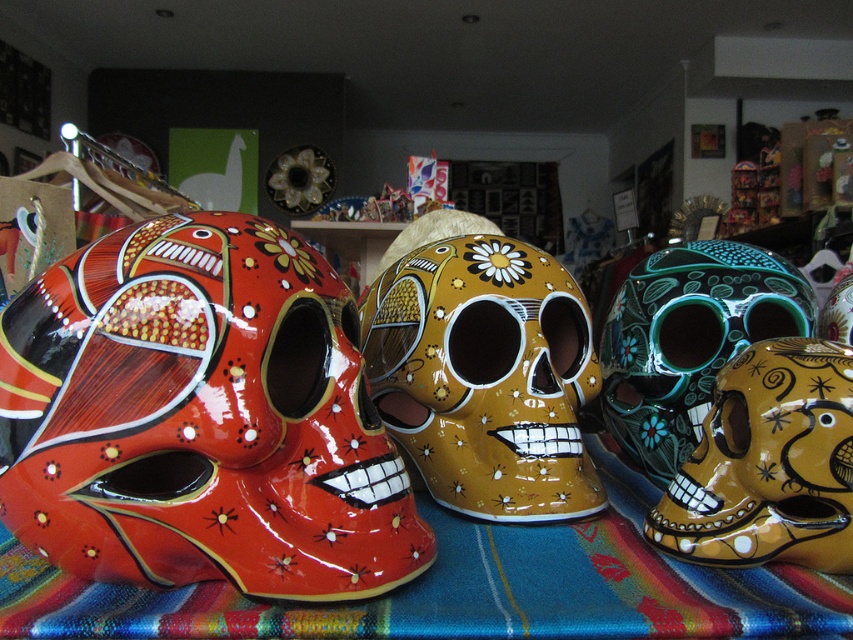
Question: Which is farther from the gold glossy skull at center?

Choices:
 (A) textured woven cloth at center
 (B) green glossy skull at center right

Answer: (B)

Question: Which point appears farthest from the camera in this image?

Choices:
 (A) (115, 552)
 (B) (691, 458)

Answer: (B)

Question: Can you confirm if gold glossy skull at center is wider than green glossy skull at center right?

Choices:
 (A) no
 (B) yes

Answer: (B)

Question: Observing the image, what is the correct spatial positioning of glossy ceramic skull at left in reference to green glossy skull at center right?

Choices:
 (A) above
 (B) below

Answer: (B)

Question: Which object is the closest to the gold glossy skull at center?

Choices:
 (A) green glossy skull at center right
 (B) textured woven cloth at center
 (C) glossy ceramic skull at left

Answer: (B)

Question: Can you confirm if textured woven cloth at center is positioned above gold glossy skull at center?

Choices:
 (A) yes
 (B) no

Answer: (B)